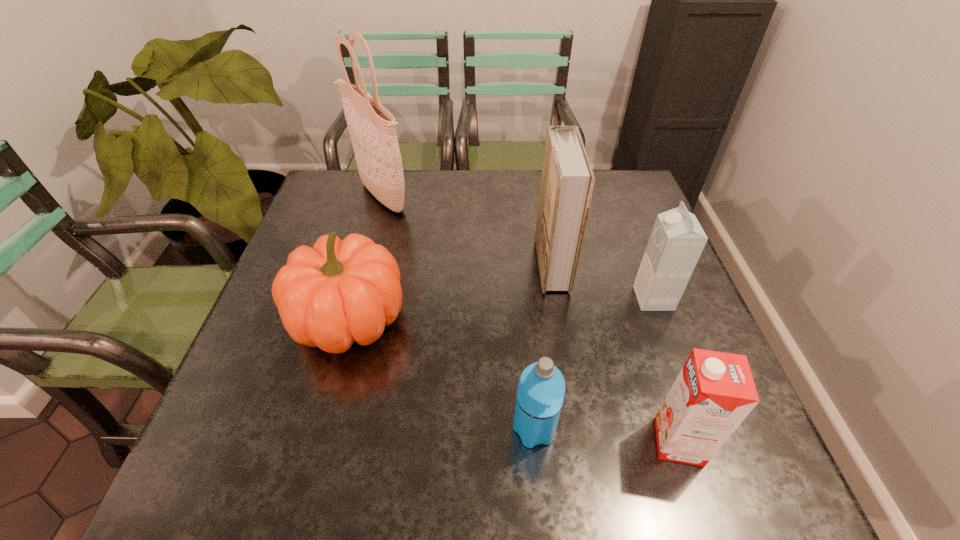
Image resolution: width=960 pixels, height=540 pixels. I want to click on free space at the far right corner of the desktop, so pos(636,190).

This screenshot has height=540, width=960. I want to click on free spot between the farther carton and the nearer carton, so click(x=666, y=370).

What are the coordinates of `empty space that is in between the farther carton and the fourth object from left to right` in the screenshot? It's located at pos(603,281).

Locate an element on the screen. This screenshot has height=540, width=960. unoccupied area between the pumpkin and the nearer carton is located at coordinates (514, 381).

I want to click on vacant area that lies between the nearer carton and the farther carton, so [666, 370].

Locate an element on the screen. The height and width of the screenshot is (540, 960). vacant area that lies between the nearer carton and the third object from right to left is located at coordinates (615, 353).

The width and height of the screenshot is (960, 540). I want to click on free space between the fifth shortest object and the tallest object, so click(x=467, y=230).

You are a GUI agent. You are given a task and a screenshot of the screen. Output one action in this format:
    pyautogui.click(x=<x>, y=<y>)
    Task: Click on the empty location between the phonebook and the fourth object from right to left
    Image resolution: width=960 pixels, height=540 pixels.
    Given the screenshot: What is the action you would take?
    pyautogui.click(x=542, y=347)

You are a GUI agent. You are given a task and a screenshot of the screen. Output one action in this format:
    pyautogui.click(x=<x>, y=<y>)
    Task: Click on the free spot between the tallest object and the third object from left to right
    This screenshot has height=540, width=960.
    Given the screenshot: What is the action you would take?
    pyautogui.click(x=458, y=313)

Identify the location of empty space between the nearer carton and the farther carton. (666, 370).